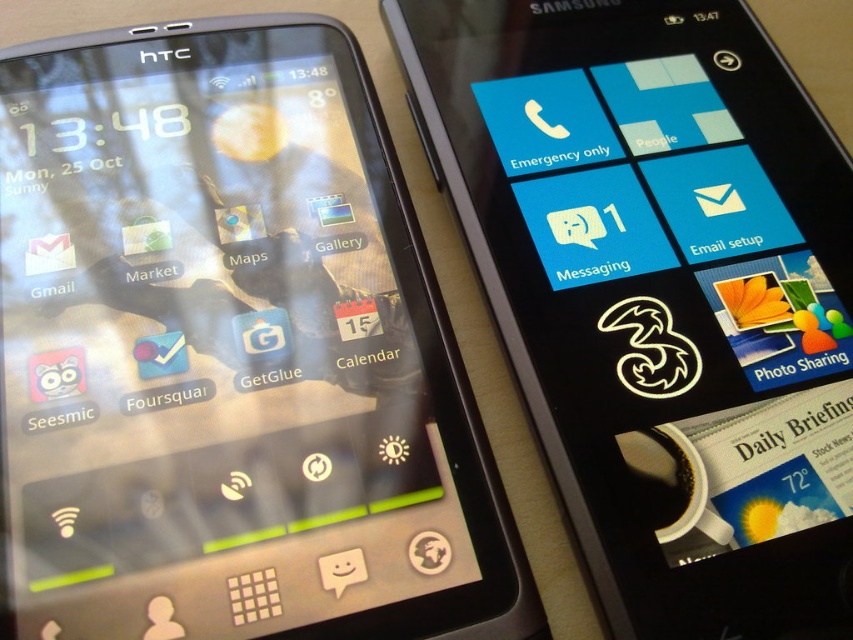
You are looking at two smartphones placed side by side on a flat surface. You notice a point at coordinates (230, 355). Which phone is positioned closest to this point?

The matte black phone at left is positioned closest to the point (230, 355).

You are setting up a display for a tech store and need to arrange two phones. You have a matte black phone at left and a black glossy phone at upper left. The store manager wants to know which phone is wider so they can place it in the center. Which phone should you choose?

The matte black phone at left is wider than the black glossy phone at upper left, so you should choose the matte black phone at left to place in the center.